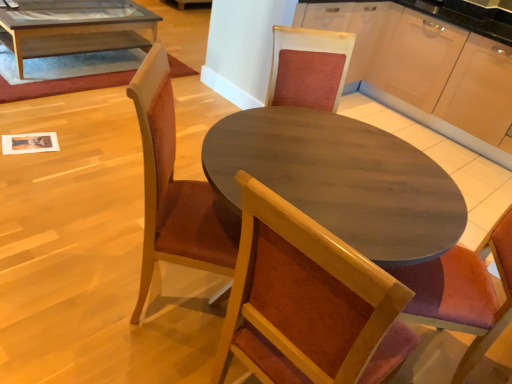
This screenshot has width=512, height=384. Find the location of `free location in front of wooden chair at center`. free location in front of wooden chair at center is located at coordinates (124, 357).